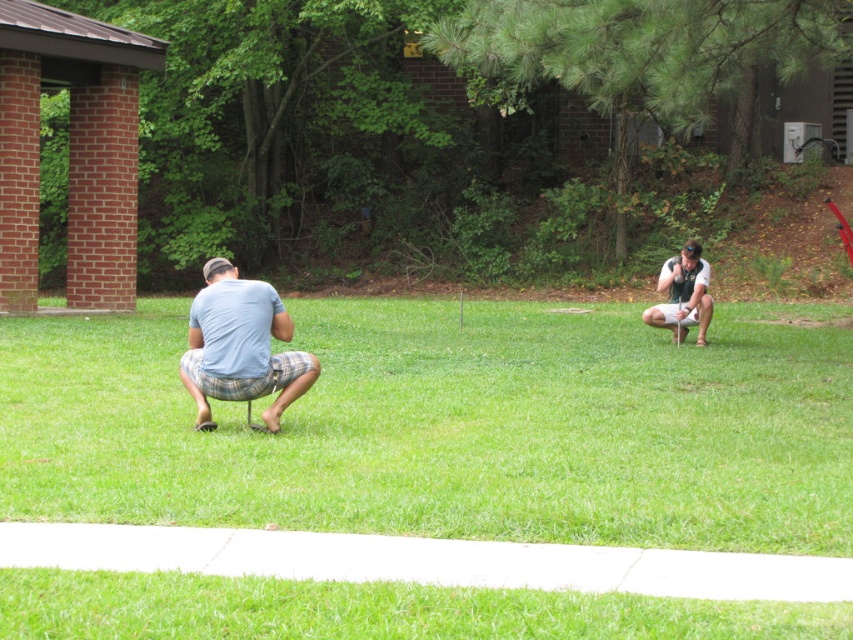
This screenshot has height=640, width=853. Describe the element at coordinates (241, 346) in the screenshot. I see `light blue cotton shirt at center` at that location.

Does light blue cotton shirt at center have a smaller size compared to white matte shirt at right?

No, light blue cotton shirt at center is not smaller than white matte shirt at right.

What do you see at coordinates (241, 346) in the screenshot? I see `light blue cotton shirt at center` at bounding box center [241, 346].

Locate an element on the screen. The image size is (853, 640). light blue cotton shirt at center is located at coordinates (241, 346).

Does green grass at center come behind white matte shirt at right?

That is False.

Is green grass at center wider than white matte shirt at right?

Correct, the width of green grass at center exceeds that of white matte shirt at right.

Where is `green grass at center`? This screenshot has width=853, height=640. green grass at center is located at coordinates (450, 426).

Where is `green grass at center`? The height and width of the screenshot is (640, 853). green grass at center is located at coordinates (450, 426).

From the picture: Is green grass at center to the left of light blue cotton shirt at center from the viewer's perspective?

In fact, green grass at center is to the right of light blue cotton shirt at center.

Is green grass at center behind light blue cotton shirt at center?

No, green grass at center is in front of light blue cotton shirt at center.

The width and height of the screenshot is (853, 640). What do you see at coordinates (450, 426) in the screenshot?
I see `green grass at center` at bounding box center [450, 426].

The height and width of the screenshot is (640, 853). What are the coordinates of `green grass at center` in the screenshot? It's located at (450, 426).